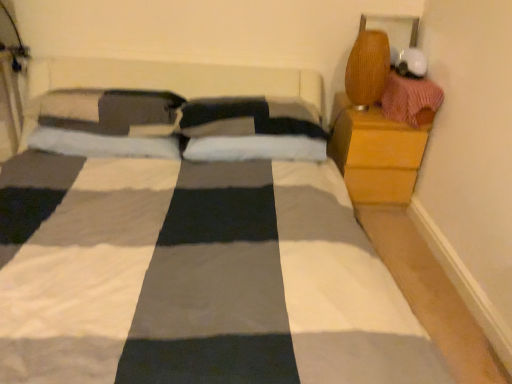
I want to click on blank space situated above knitted pink sweater at upper right (from a real-world perspective), so click(410, 77).